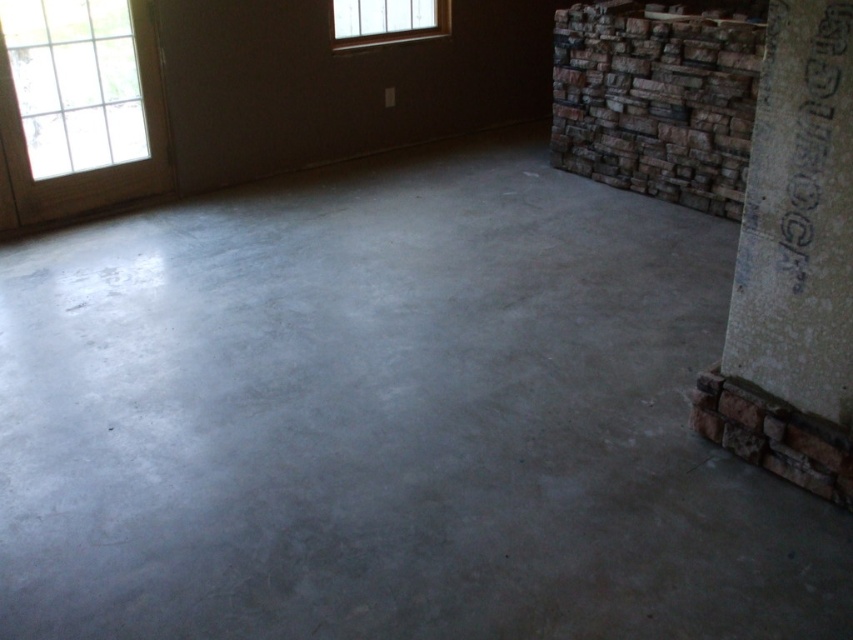
From the picture: How distant is white concrete pillar at right from clear glass window at upper left?

12.20 feet

Where is `white concrete pillar at right`? The image size is (853, 640). white concrete pillar at right is located at coordinates (793, 264).

You are a GUI agent. You are given a task and a screenshot of the screen. Output one action in this format:
    pyautogui.click(x=<x>, y=<y>)
    Task: Click on the white concrete pillar at right
    
    Given the screenshot: What is the action you would take?
    pyautogui.click(x=793, y=264)

Measure the distance between clear glass window at upper left and camera.

clear glass window at upper left and camera are 3.75 meters apart from each other.

Based on the photo, between clear glass window at upper left and clear glass window at upper center, which one is positioned higher?

clear glass window at upper center

Is point (90, 100) in front of point (358, 19)?

Yes, point (90, 100) is closer to viewer.

Locate an element on the screen. This screenshot has width=853, height=640. clear glass window at upper left is located at coordinates (74, 83).

Image resolution: width=853 pixels, height=640 pixels. What are the coordinates of `white concrete pillar at right` in the screenshot? It's located at (793, 264).

Which is behind, point (795, 99) or point (376, 8)?

The point (376, 8) is more distant.

Is point (828, 29) positioned before point (387, 12)?

Yes, it is.

Where is `white concrete pillar at right`? white concrete pillar at right is located at coordinates click(x=793, y=264).